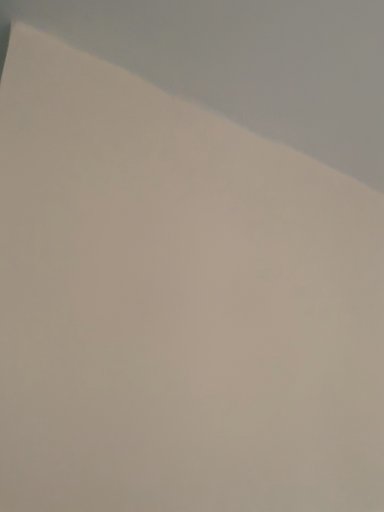
Describe the element at coordinates (248, 63) in the screenshot. The width and height of the screenshot is (384, 512). I see `white matte cloud at upper left` at that location.

The image size is (384, 512). I want to click on white matte cloud at upper left, so click(248, 63).

This screenshot has height=512, width=384. I want to click on white matte cloud at upper left, so (x=248, y=63).